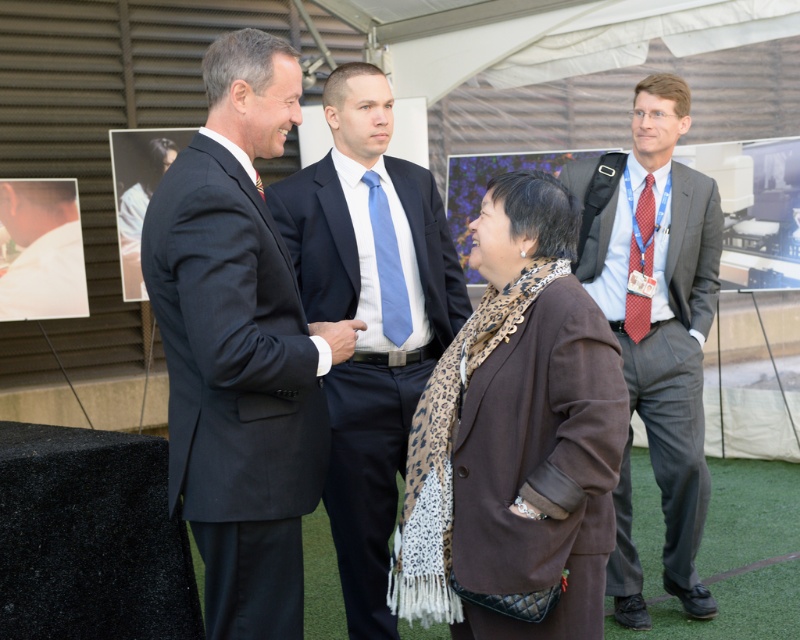
Is light blue silk tie at center closer to the viewer compared to blue silk tie at center?

No, it is behind blue silk tie at center.

Which of these two, light blue silk tie at center or blue silk tie at center, stands taller?

Answer: With more height is light blue silk tie at center.

The height and width of the screenshot is (640, 800). In order to click on light blue silk tie at center in this screenshot , I will do `click(388, 264)`.

Is blue satin tie at center smaller than matte gray suit at right?

Correct, blue satin tie at center occupies less space than matte gray suit at right.

Who is more forward, [332,296] or [629,586]?

Point [332,296] is more forward.

Identify the location of blue satin tie at center. The width and height of the screenshot is (800, 640). (370, 316).

Does red dotted tie at right have a smaller size compared to blue silk tie at center?

Incorrect, red dotted tie at right is not smaller in size than blue silk tie at center.

Does red dotted tie at right appear on the right side of blue silk tie at center?

Indeed, red dotted tie at right is positioned on the right side of blue silk tie at center.

Does point (641, 198) come closer to viewer compared to point (256, 182)?

No, it is not.

At what (x,y) coordinates should I click in order to perform the action: click on red dotted tie at right. Please return your answer as a coordinate pair (x, y). Looking at the image, I should click on point(644,230).